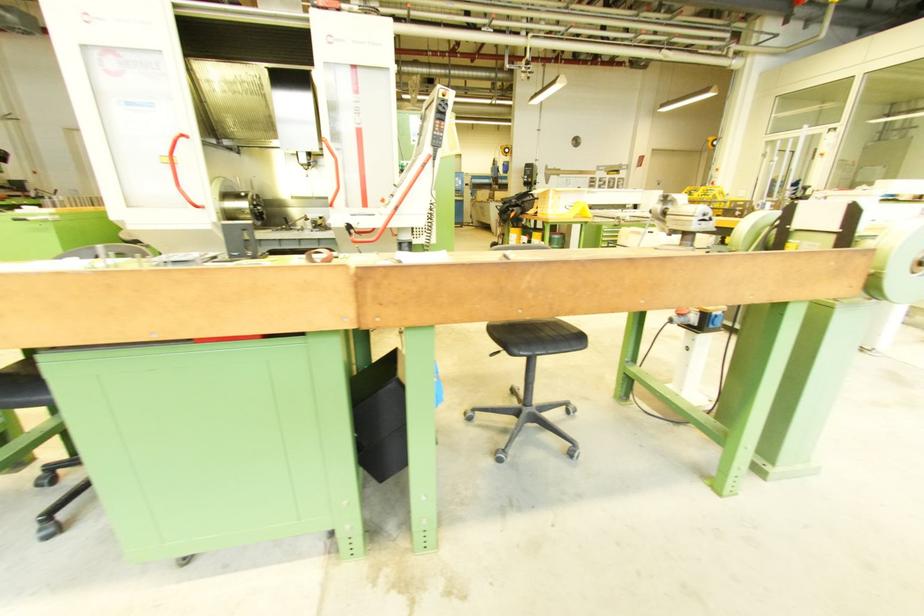
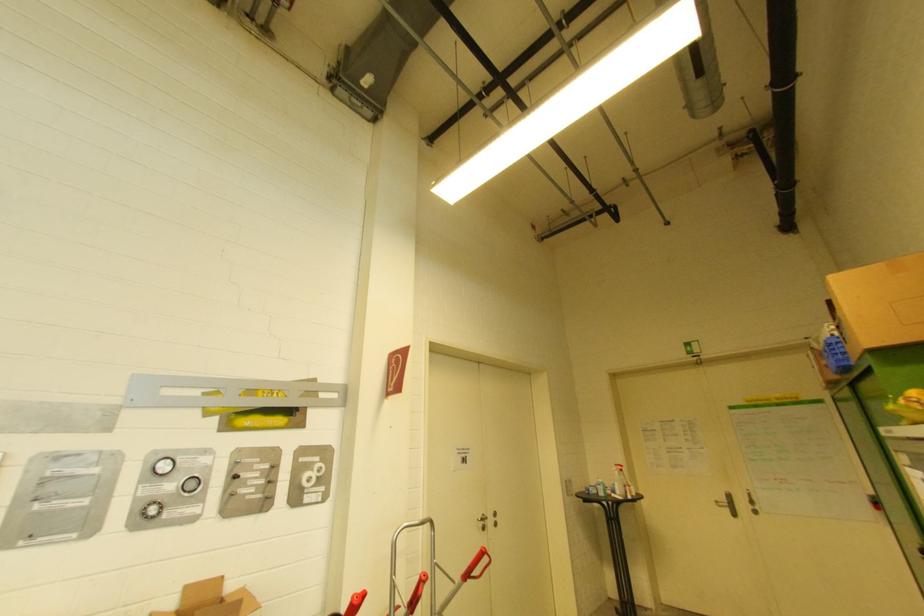
The point at (602,188) is marked in the first image. Where is the corresponding point in the second image?

(149, 517)